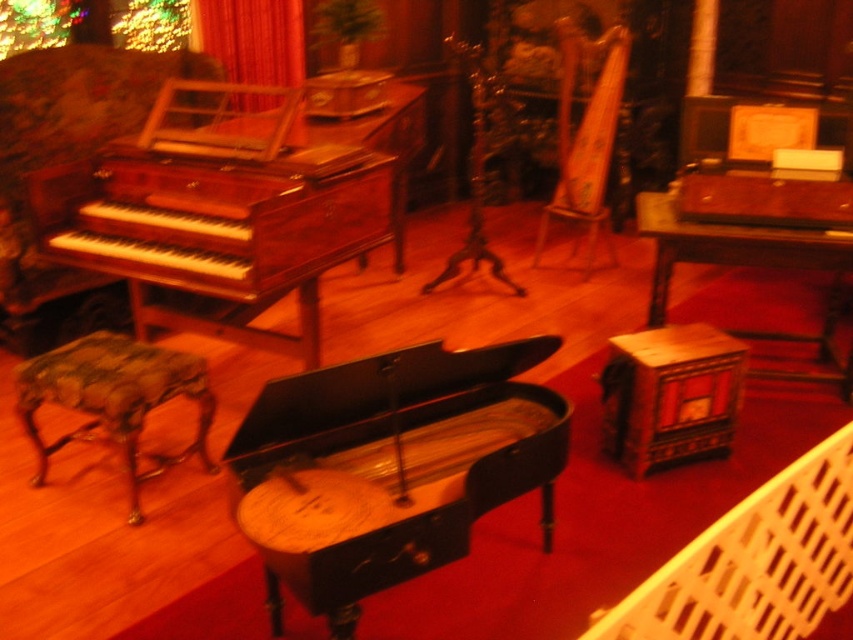
You are a guest in this room and want to sit down on the wooden stool at lower right. Can you see the velvet curtain at upper left from your seated position?

Yes, because the wooden stool at lower right is below the velvet curtain at upper left, so when sitting on the stool, the curtain would be above and visible.